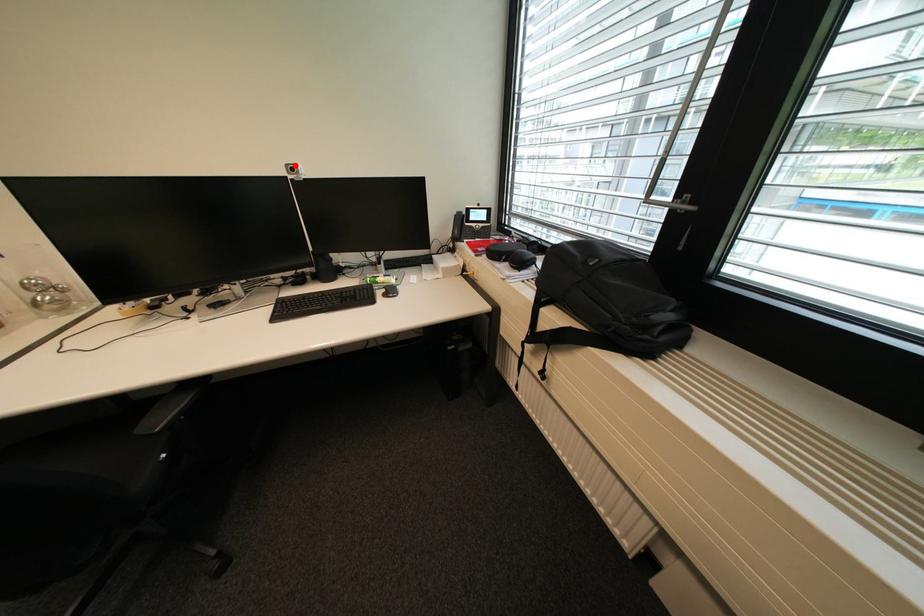
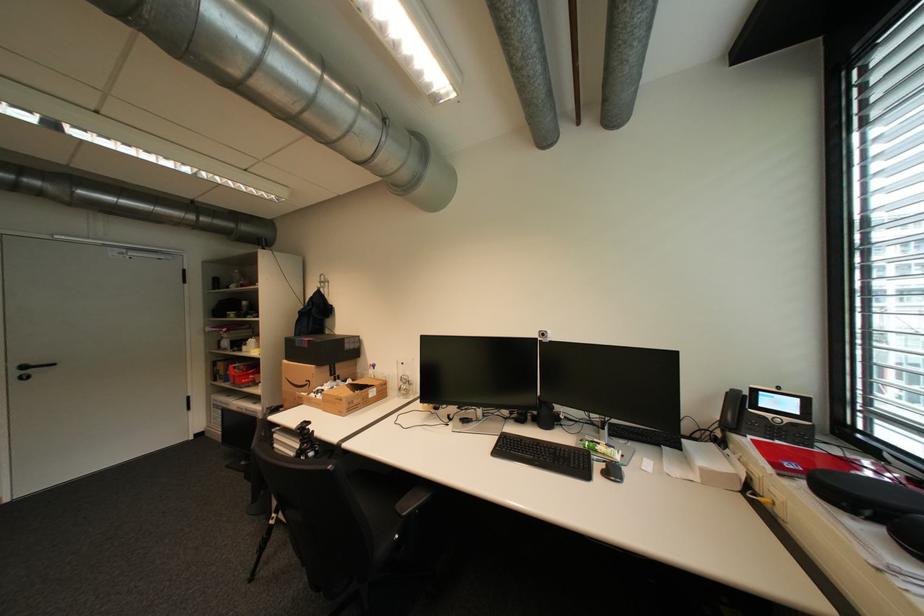
Find the pixel in the second image that matches the highlighted location in the first image.

(548, 331)